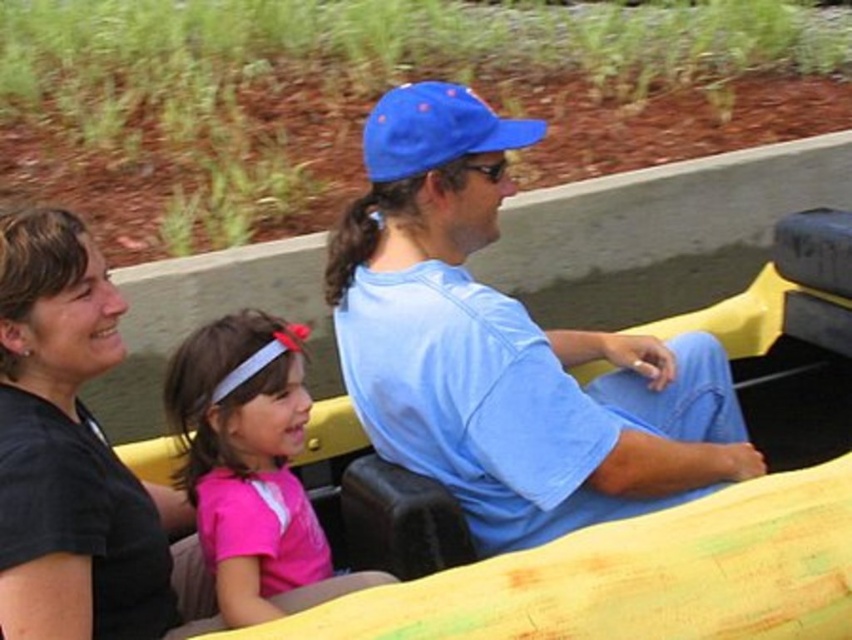
What is the position of the black matte shirt at upper left in the image?

The black matte shirt at upper left is located at point (68, 451).

You are standing at the camera position and want to hand the black matte shirt at upper left to someone. Can you reach it without moving from your current position?

The black matte shirt at upper left and the camera are 5.28 feet apart, so you cannot reach it without moving from your current position since the distance is too far.

Looking at the scene, which object is positioned higher between the black matte shirt at upper left and the blue fabric baseball cap at center?

The black matte shirt at upper left is taller than the blue fabric baseball cap at center.